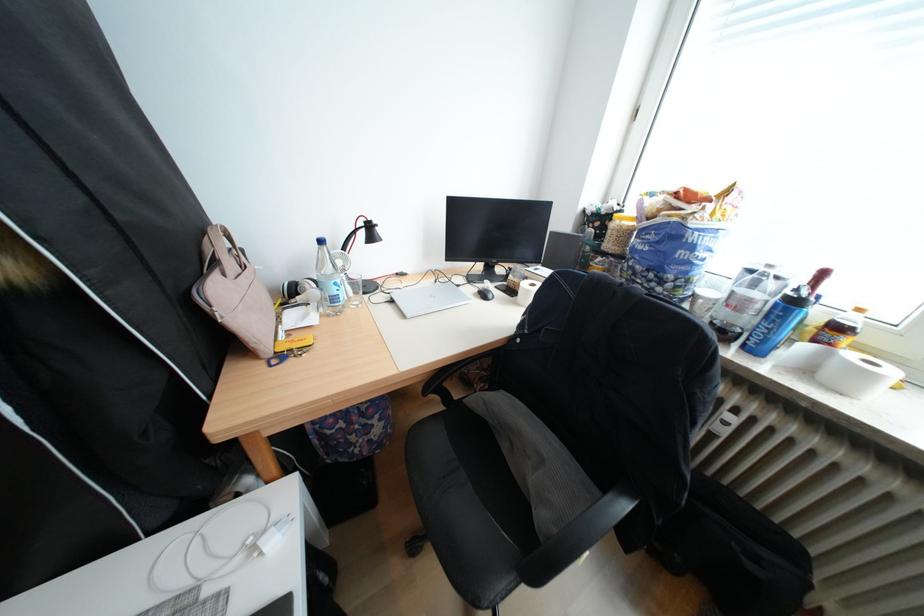
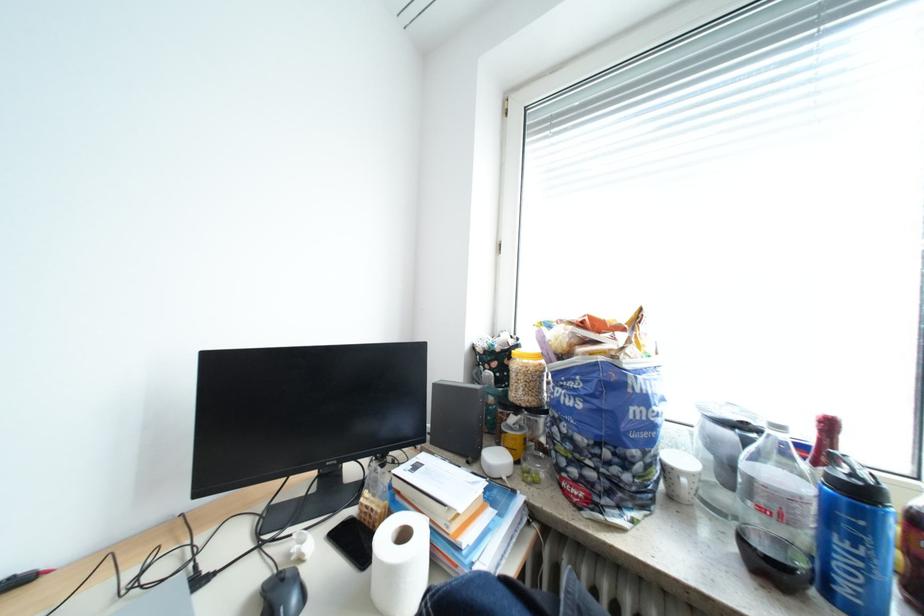
How did the camera likely rotate?

The camera's rotation is toward right-up.